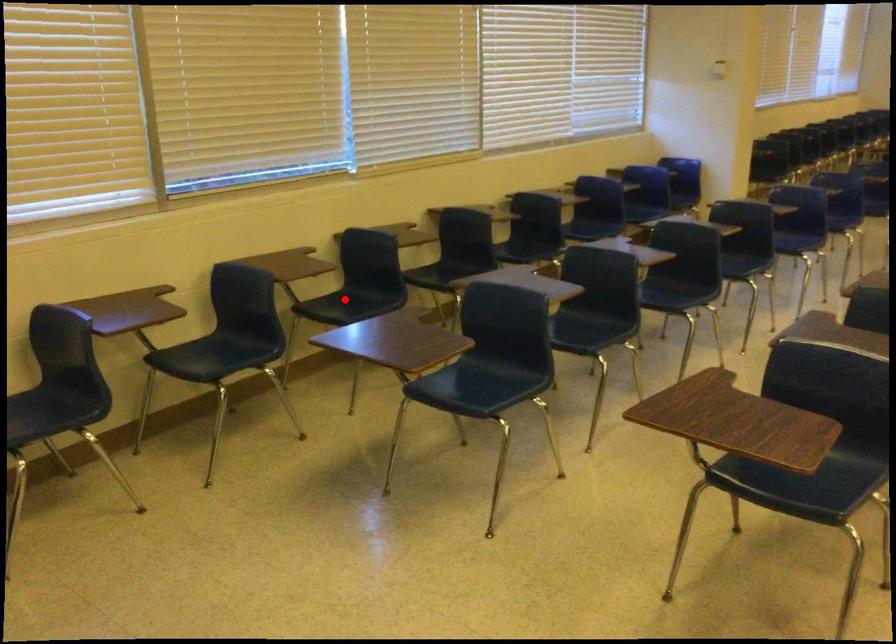
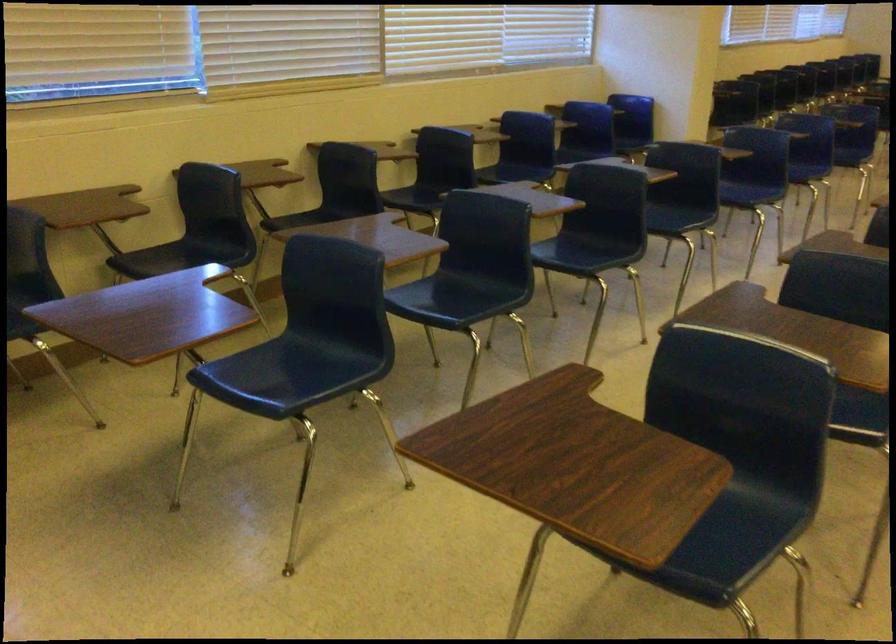
Question: I am providing you with two images of the same scene from different viewpoints. Image1 has a red point marked. In image2, the corresponding 3D location appears at what relative position? Reply with the corresponding letter.

Choices:
 (A) Closer
 (B) Farther

Answer: (A)